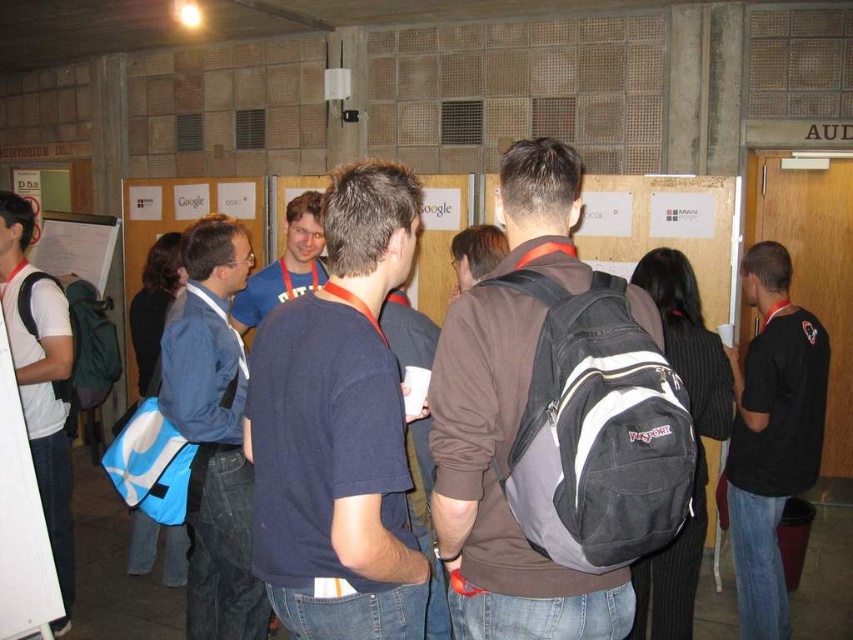
Consider the image. Is black cotton shirt at right bigger than white matte t-shirt at left?

Actually, black cotton shirt at right might be smaller than white matte t-shirt at left.

Between point (735, 531) and point (56, 288), which one is positioned behind?

Positioned behind is point (56, 288).

Where is `black cotton shirt at right`? This screenshot has width=853, height=640. black cotton shirt at right is located at coordinates (770, 435).

Does black cotton shirt at right have a smaller size compared to brown fabric backpack at center?

No, black cotton shirt at right is not smaller than brown fabric backpack at center.

This screenshot has width=853, height=640. Describe the element at coordinates (770, 435) in the screenshot. I see `black cotton shirt at right` at that location.

The height and width of the screenshot is (640, 853). What are the coordinates of `black cotton shirt at right` in the screenshot? It's located at (770, 435).

How much distance is there between blue cotton t-shirt at center and brown fabric backpack at center?

The distance of blue cotton t-shirt at center from brown fabric backpack at center is 32.90 inches.

Is blue cotton t-shirt at center wider than brown fabric backpack at center?

Yes, blue cotton t-shirt at center is wider than brown fabric backpack at center.

Measure the distance between blue cotton t-shirt at center and camera.

blue cotton t-shirt at center and camera are 3.12 meters apart from each other.

At what (x,y) coordinates should I click in order to perform the action: click on blue cotton t-shirt at center. Please return your answer as a coordinate pair (x, y). Looking at the image, I should click on (285, 266).